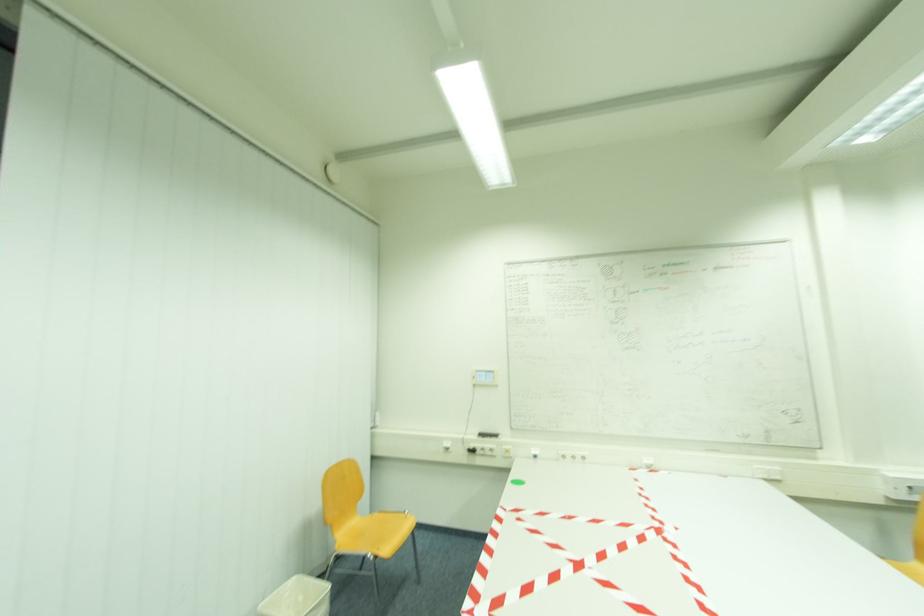
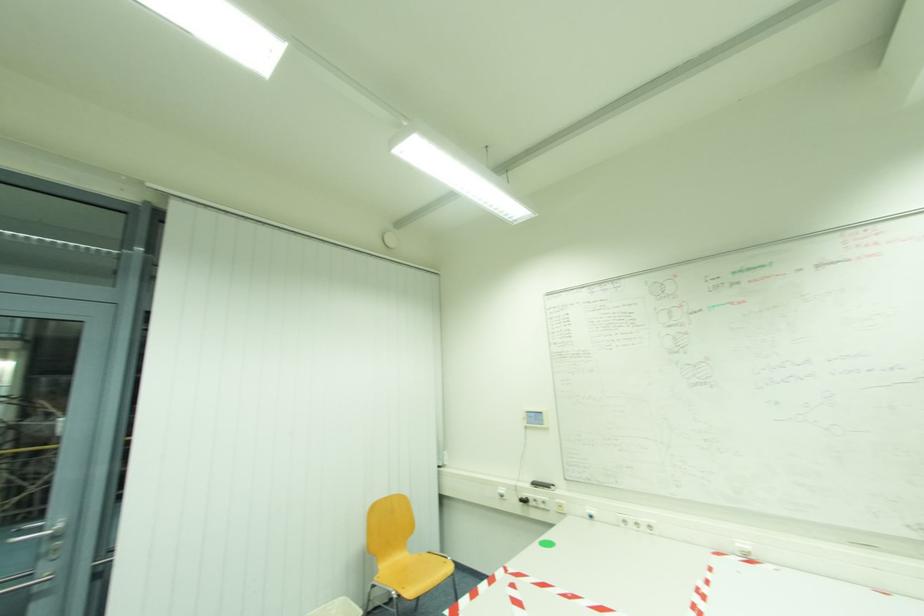
Question: The first image is from the beginning of the video and the second image is from the end. How did the camera likely rotate when shooting the video?

Choices:
 (A) Left
 (B) Right
 (C) Up
 (D) Down

Answer: (A)